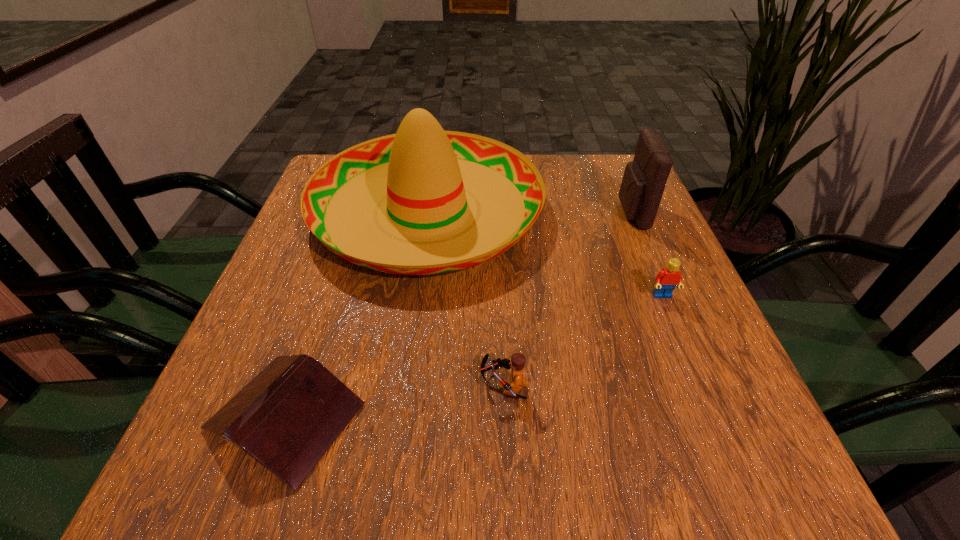
Image resolution: width=960 pixels, height=540 pixels. Find the location of `free space that is in between the book and the farther Lego`. free space that is in between the book and the farther Lego is located at coordinates (474, 356).

Locate an element on the screen. The height and width of the screenshot is (540, 960). vacant region between the farther Lego and the nearer Lego is located at coordinates (583, 341).

Find the location of a particular element. This screenshot has width=960, height=540. free point between the pouch and the nearer Lego is located at coordinates click(567, 299).

The height and width of the screenshot is (540, 960). Find the location of `vacant area that lies between the sombrero and the nearer Lego`. vacant area that lies between the sombrero and the nearer Lego is located at coordinates [x=466, y=298].

This screenshot has height=540, width=960. I want to click on free space between the right Lego and the left Lego, so click(x=583, y=341).

This screenshot has width=960, height=540. I want to click on vacant area that lies between the right Lego and the shortest object, so click(x=474, y=356).

Where is `free spot between the left Lego and the book`? The image size is (960, 540). free spot between the left Lego and the book is located at coordinates (395, 401).

The image size is (960, 540). Find the location of `empty space that is in between the left Lego and the farther Lego`. empty space that is in between the left Lego and the farther Lego is located at coordinates (583, 341).

This screenshot has height=540, width=960. In order to click on vacant area that lies between the second tallest object and the farther Lego in this screenshot , I will do `click(647, 254)`.

You are a GUI agent. You are given a task and a screenshot of the screen. Output one action in this format:
    pyautogui.click(x=<x>, y=<y>)
    Task: Click on the object that is the closest to the sombrero
    
    Given the screenshot: What is the action you would take?
    pyautogui.click(x=287, y=417)